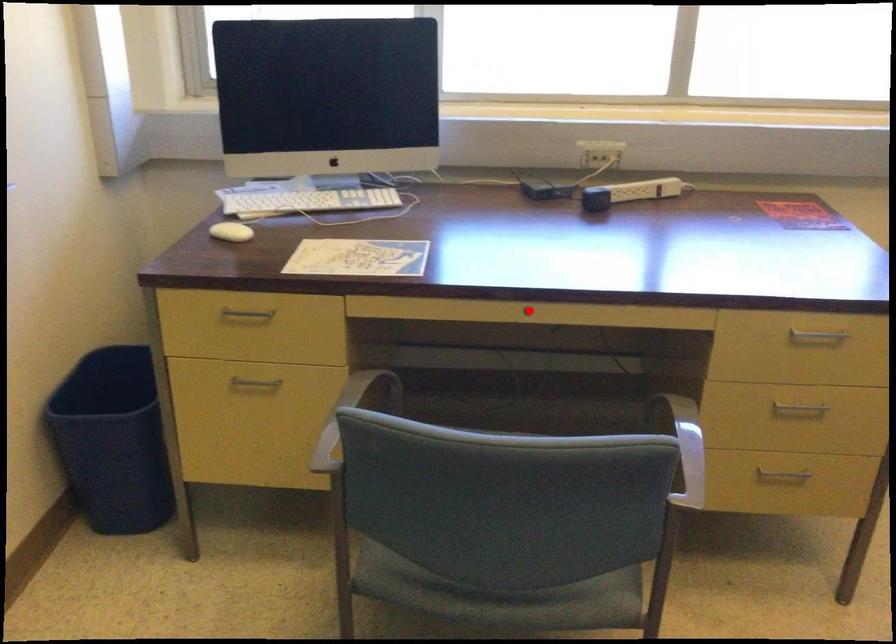
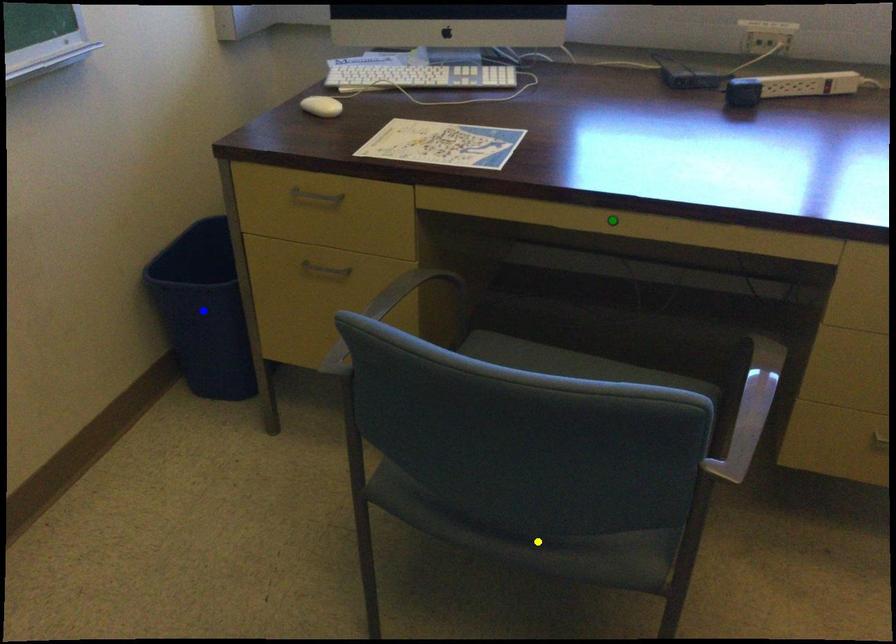
Question: I am providing you with two images of the same scene from different viewpoints. A red point is marked on the first image. You are given multiple points on the second image. Which spot in image 2 lines up with the point in image 1?

Choices:
 (A) yellow point
 (B) green point
 (C) blue point

Answer: (B)